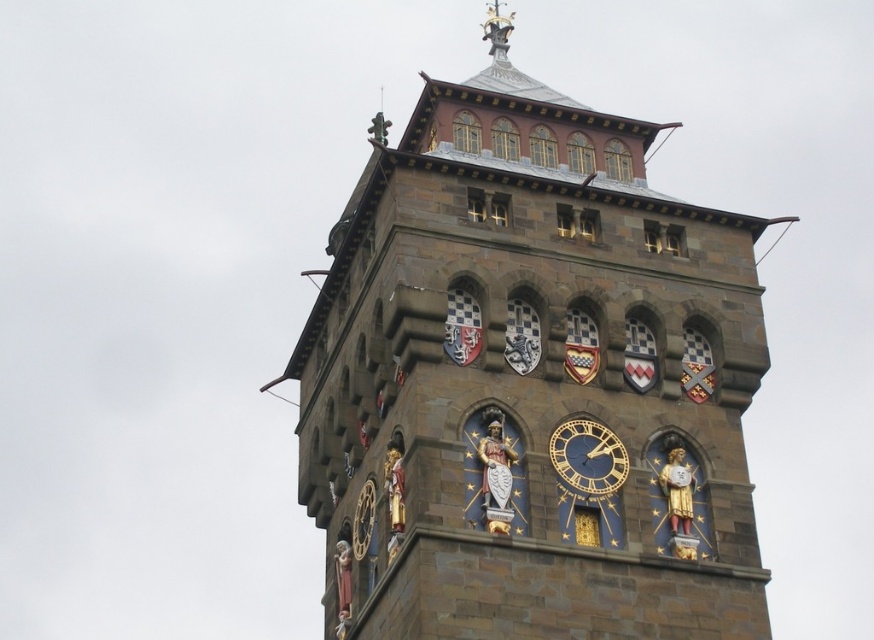
Question: Which point is farther to the camera?

Choices:
 (A) (557, 467)
 (B) (399, 312)
 (C) (482, 35)

Answer: (C)

Question: Is gold metallic clock at center behind polished brass statue at upper center?

Choices:
 (A) yes
 (B) no

Answer: (B)

Question: Which object is positioned farthest from the brown stone clock tower at center?

Choices:
 (A) polished brass statue at upper center
 (B) gold metallic clock at center

Answer: (A)

Question: Which point appears farthest from the camera in this image?

Choices:
 (A) (422, 429)
 (B) (497, 58)
 (C) (588, 451)

Answer: (B)

Question: Does brown stone clock tower at center have a lesser width compared to gold metallic clock at center?

Choices:
 (A) no
 (B) yes

Answer: (A)

Question: Is brown stone clock tower at center to the left of polished brass statue at upper center from the viewer's perspective?

Choices:
 (A) no
 (B) yes

Answer: (B)